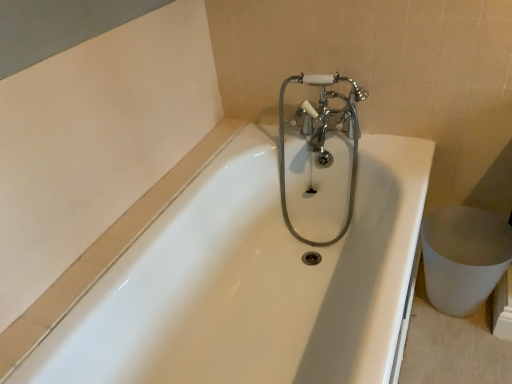
Question: Which is correct: white glossy bathtub at center is inside chrome/polished metal faucet at center, or outside of it?

Choices:
 (A) outside
 (B) inside

Answer: (A)

Question: From the image's perspective, relative to chrome/polished metal faucet at center, is white glossy bathtub at center above or below?

Choices:
 (A) above
 (B) below

Answer: (B)

Question: Is point pos(252,380) closer or farther from the camera than point pos(324,140)?

Choices:
 (A) closer
 (B) farther

Answer: (A)

Question: From a real-world perspective, is chrome/polished metal faucet at center physically located above or below white glossy bathtub at center?

Choices:
 (A) below
 (B) above

Answer: (B)

Question: In terms of width, does chrome/polished metal faucet at center look wider or thinner when compared to white glossy bathtub at center?

Choices:
 (A) thin
 (B) wide

Answer: (A)

Question: Is point (281, 193) positioned closer to the camera than point (392, 142)?

Choices:
 (A) farther
 (B) closer

Answer: (A)

Question: In terms of size, does chrome/polished metal faucet at center appear bigger or smaller than white glossy bathtub at center?

Choices:
 (A) small
 (B) big

Answer: (A)